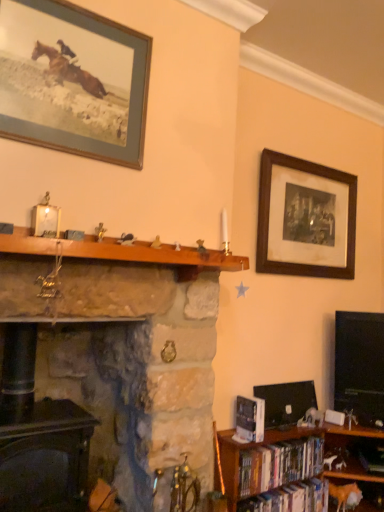
What are the coordinates of `empty space that is ontop of wooden picture frame at upper right, the 1th picture frame in the back-to-front sequence (from a real-world perspective)` in the screenshot? It's located at tap(312, 163).